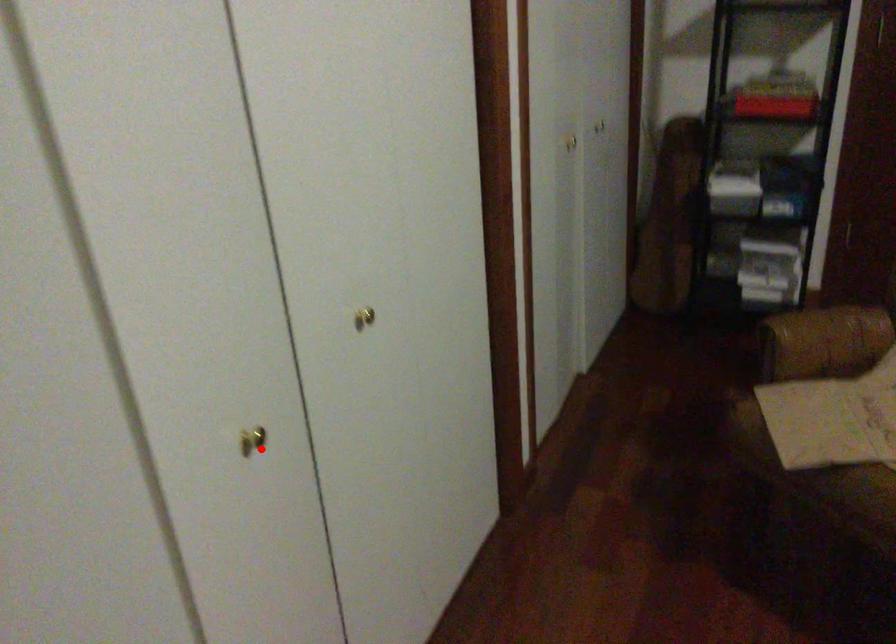
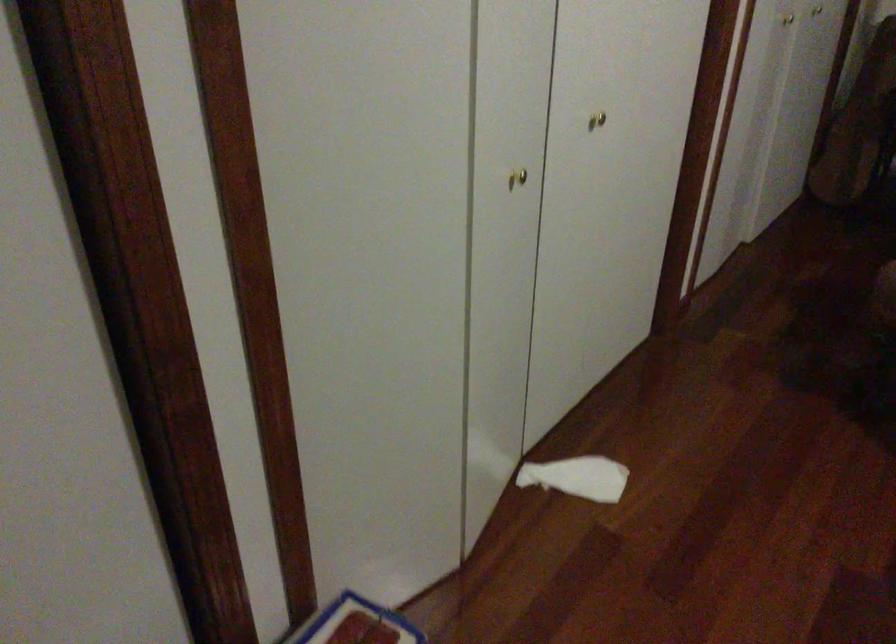
Question: I am providing you with two images of the same scene from different viewpoints. In image1, a red point is highlighted. Considering the same 3D point in image2, which of the following is correct?

Choices:
 (A) It is closer
 (B) It is farther

Answer: (B)